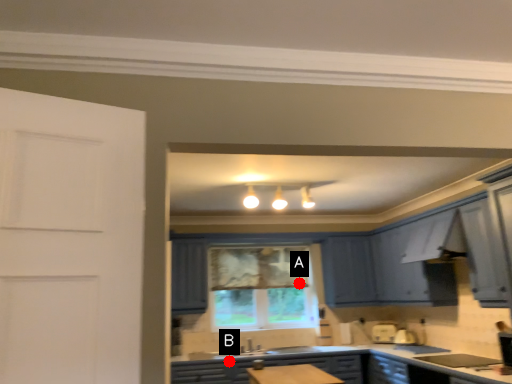
Question: Two points are circled on the image, labeled by A and B beside each circle. Which point is closer to the camera?

Choices:
 (A) A is closer
 (B) B is closer

Answer: (B)